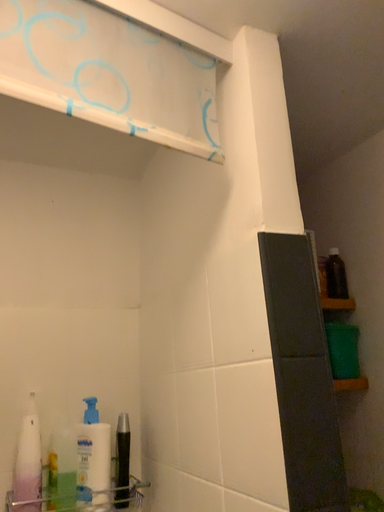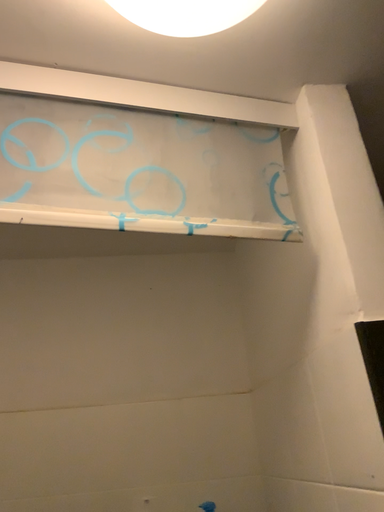
Question: Which way did the camera rotate in the video?

Choices:
 (A) rotated left
 (B) rotated right

Answer: (A)